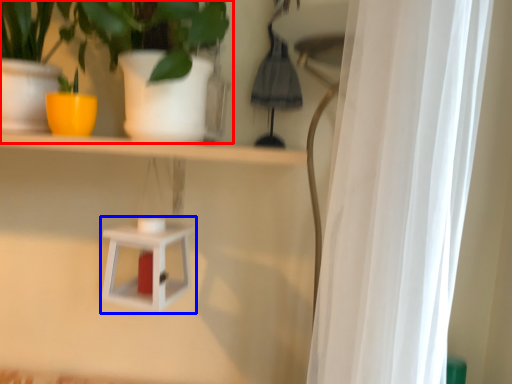
Question: Which of the following is the closest to the observer, houseplant (highlighted by a red box) or shelf (highlighted by a blue box)?

Choices:
 (A) houseplant
 (B) shelf

Answer: (A)